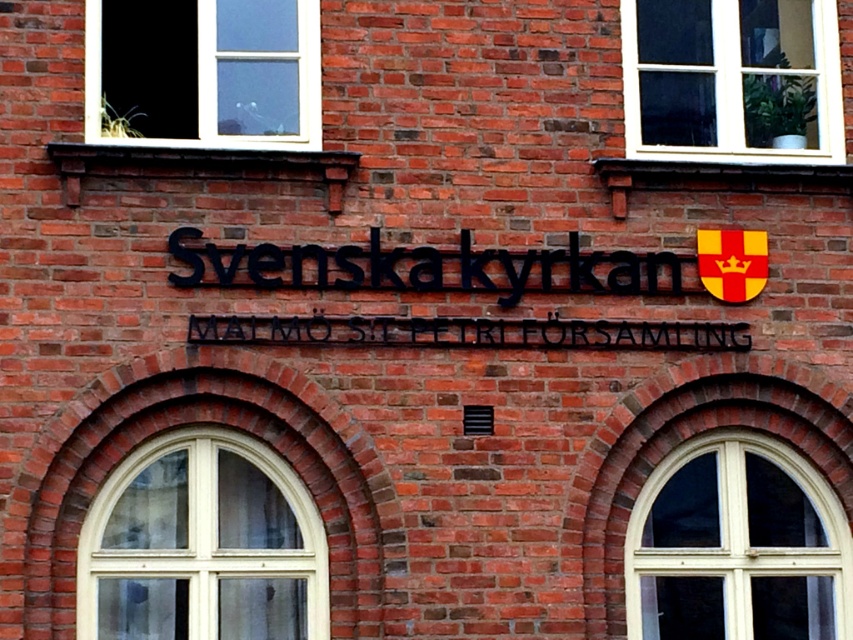
From the picture: What is the spatial relationship between the white wooden window at lower right and the black metal sign at center?

The white wooden window at lower right is located to the right of the black metal sign at center.

In the scene shown: You are an architect designing a new building and want to ensure that the windows match the traditional style of the building shown. Which window should you choose between the white wood window at lower left and the white plastic window at upper right?

The white wood window at lower left is taller than the white plastic window at upper right, so it better matches the traditional style of the building.